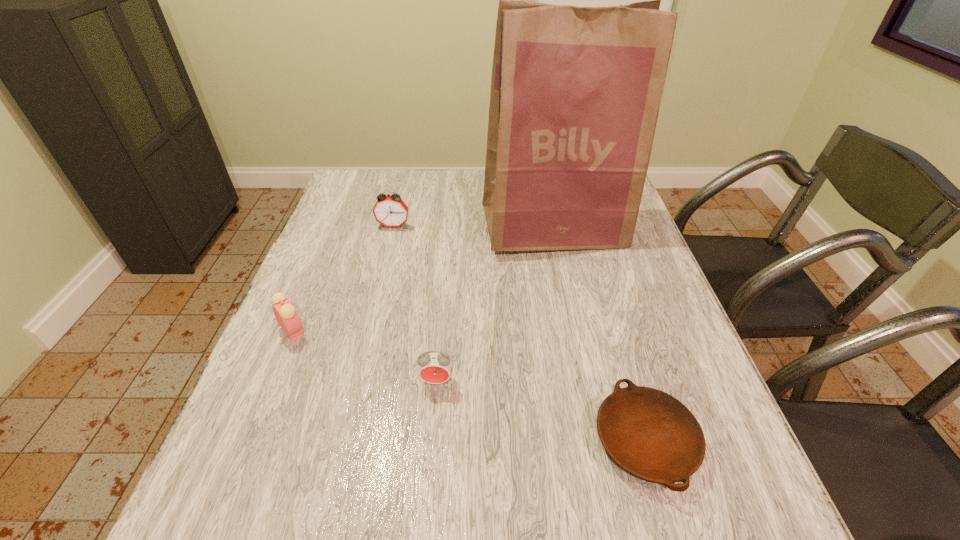
Where is `free spot at the far edge of the desktop`? This screenshot has height=540, width=960. free spot at the far edge of the desktop is located at coordinates (435, 184).

Find the location of a particular element. This screenshot has height=540, width=960. blank space at the left edge of the desktop is located at coordinates (327, 362).

Locate an element on the screen. Image resolution: width=960 pixels, height=540 pixels. vacant space at the right edge of the desktop is located at coordinates (659, 298).

Locate an element on the screen. vacant region at the far left corner is located at coordinates (375, 203).

In the image, there is a desktop. Identify the location of free space at the near left corner. This screenshot has width=960, height=540. (221, 509).

Locate an element on the screen. This screenshot has height=540, width=960. vacant area between the second alarm clock from right to left and the plate is located at coordinates (519, 333).

Locate an element on the screen. unoccupied position between the fourth object from right to left and the nearest object is located at coordinates (519, 333).

Where is `empty space between the fourth farthest object and the grocery bag`? The height and width of the screenshot is (540, 960). empty space between the fourth farthest object and the grocery bag is located at coordinates (495, 305).

In order to click on vacant space in between the leftmost alarm clock and the plate in this screenshot , I will do `click(469, 386)`.

Locate an element on the screen. This screenshot has width=960, height=540. free space between the fourth shortest object and the shortest object is located at coordinates (519, 333).